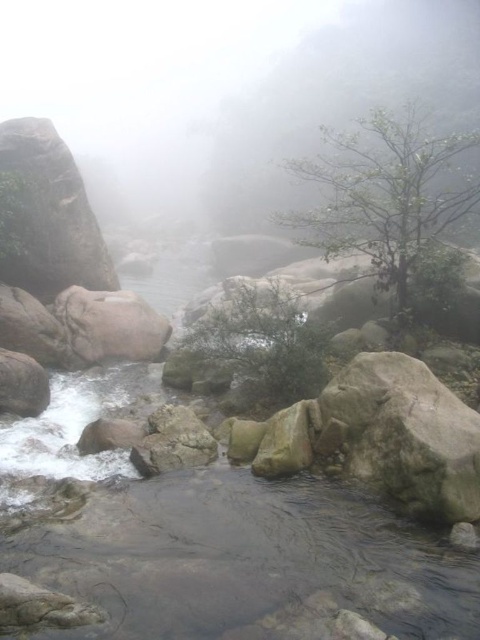
You are standing at the edge of the rocky stream and see two points marked in the image. Which point, point [105,524] or point [87,276], is closer to you?

Point [105,524] is closer to the viewer than point [87,276].

You are standing at the edge of the stream and see the point labeled as point (216, 538). What is the location of this point relative to the clear water at center?

The point (216, 538) corresponds to the clear water at center, so it is located exactly at the center of the clear water area.

You are standing on the smooth granite boulder at left and want to step into the clear water at center. Is the water directly below your current position?

Yes, the clear water at center is located below the smooth granite boulder at left, so stepping down would place you directly into the water.